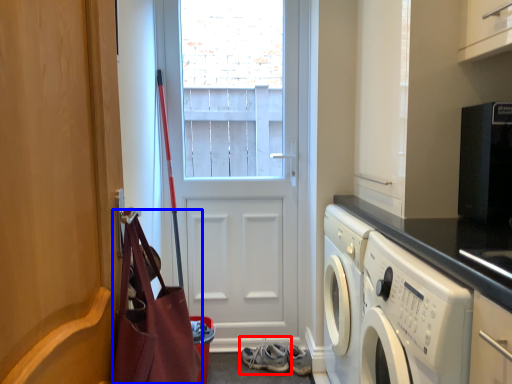
Question: Which point is further to the camera, footwear (highlighted by a red box) or bag (highlighted by a blue box)?

Choices:
 (A) footwear
 (B) bag

Answer: (A)